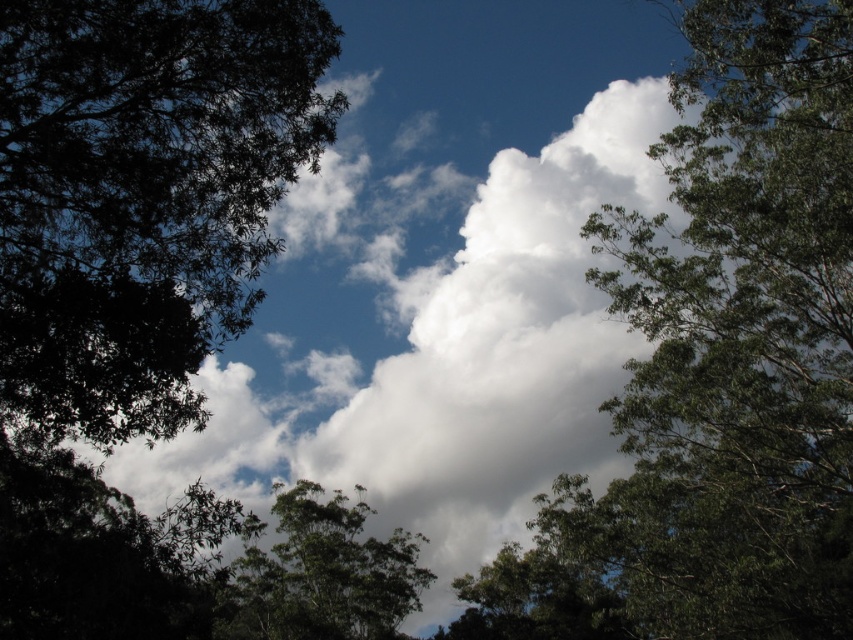
Question: Is green leafy tree at upper right to the right of green leafy tree at left from the viewer's perspective?

Choices:
 (A) no
 (B) yes

Answer: (B)

Question: Which point is farther to the camera?

Choices:
 (A) green leafy tree at center
 (B) green leafy tree at upper right
 (C) green leafy tree at left

Answer: (A)

Question: Which point is farther from the camera taking this photo?

Choices:
 (A) (84, 44)
 (B) (259, 600)
 (C) (735, 228)

Answer: (B)

Question: Can you confirm if green leafy tree at left is smaller than green leafy tree at center?

Choices:
 (A) yes
 (B) no

Answer: (A)

Question: Which of the following is the closest to the observer?

Choices:
 (A) green leafy tree at left
 (B) green leafy tree at upper right

Answer: (A)

Question: Does green leafy tree at upper right have a smaller size compared to green leafy tree at left?

Choices:
 (A) no
 (B) yes

Answer: (A)